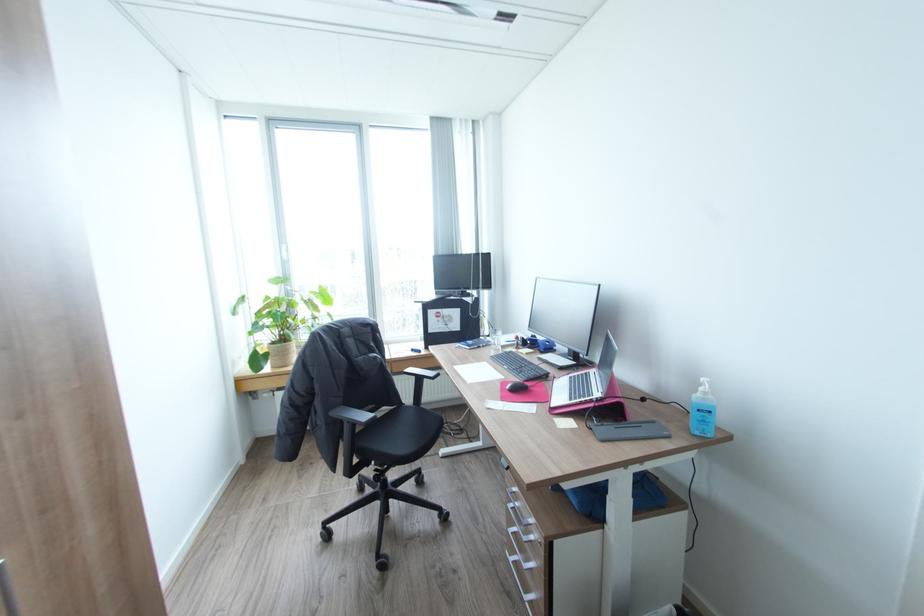
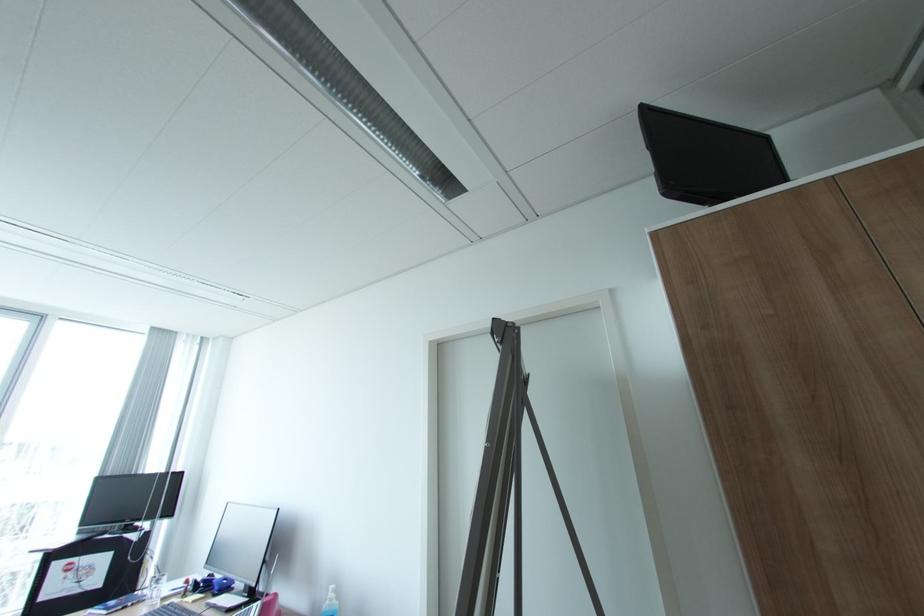
Locate, in the second image, the point that corresponds to [710,392] in the first image.

(336, 599)